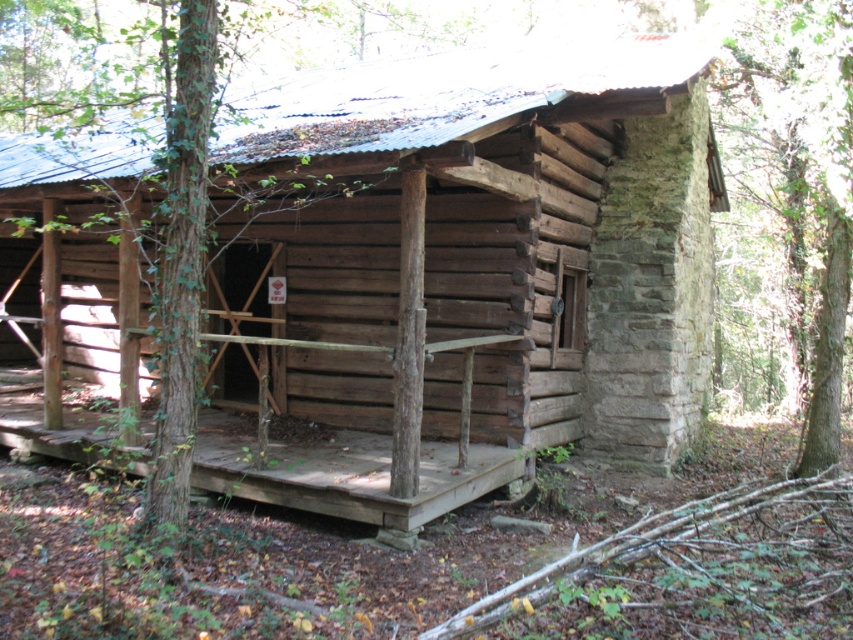
You are standing in front of the rustic wooden cabin and notice a point marked at coordinates (787,211). What object does this point indicate?

The point at coordinates (787,211) indicates a green leafy tree at right.